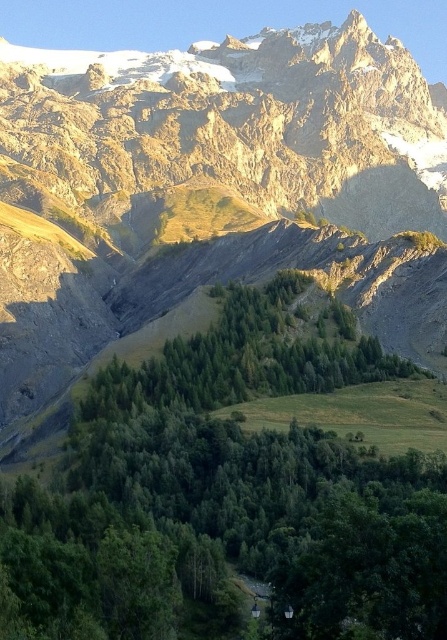
Question: Which of the following is the closest to the observer?

Choices:
 (A) (417, 129)
 (B) (329, 412)

Answer: (B)

Question: Which point is farther from the camera taking this photo?

Choices:
 (A) (181, 106)
 (B) (338, 490)

Answer: (A)

Question: Can you confirm if rugged stone mountain at upper center is thinner than green leafy trees at center?

Choices:
 (A) no
 (B) yes

Answer: (A)

Question: Can you confirm if rugged stone mountain at upper center is positioned to the right of green leafy trees at center?

Choices:
 (A) no
 (B) yes

Answer: (A)

Question: Can you confirm if rugged stone mountain at upper center is positioned to the left of green leafy trees at center?

Choices:
 (A) yes
 (B) no

Answer: (A)